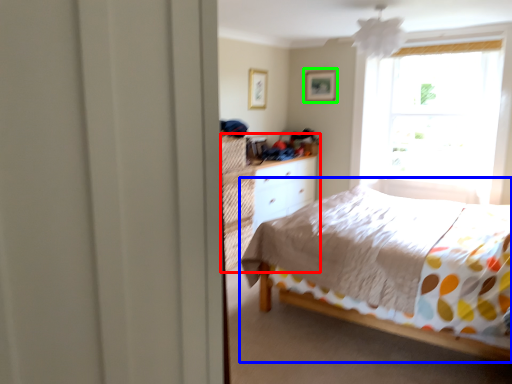
Question: Which is farther away from dresser (highlighted by a red box)? bed (highlighted by a blue box) or picture frame (highlighted by a green box)?

Choices:
 (A) bed
 (B) picture frame

Answer: (B)